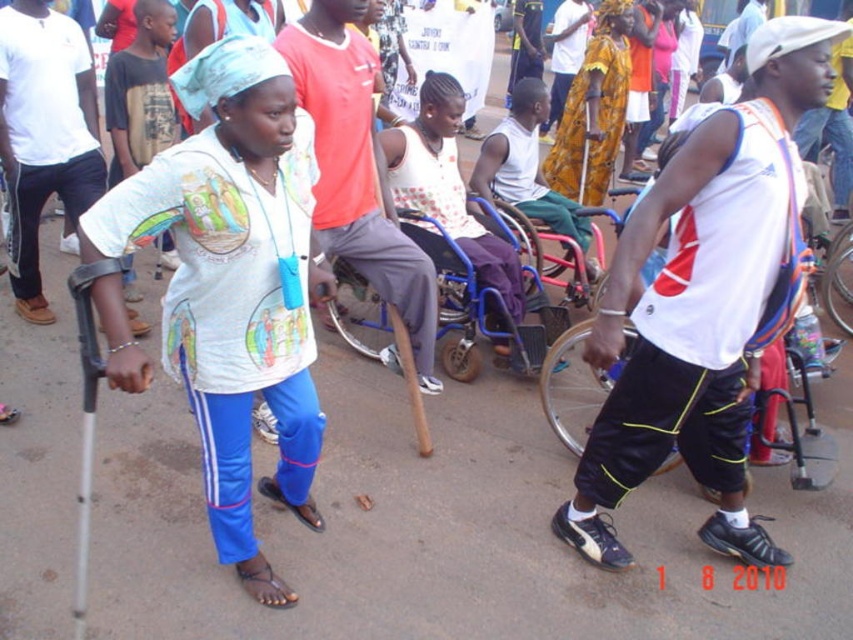
Does white matte shirt at left have a lesser width compared to blue plastic wheelchair at center?

Yes, white matte shirt at left is thinner than blue plastic wheelchair at center.

Is point (294, 124) positioned in front of point (440, 269)?

That is True.

What do you see at coordinates (234, 284) in the screenshot? This screenshot has width=853, height=640. I see `white matte shirt at left` at bounding box center [234, 284].

This screenshot has height=640, width=853. Find the location of `white matte shirt at left`. white matte shirt at left is located at coordinates (234, 284).

Does white matte shirt at left have a lesser width compared to wooden cane at center?

Correct, white matte shirt at left's width is less than wooden cane at center's.

Describe the element at coordinates (234, 284) in the screenshot. I see `white matte shirt at left` at that location.

Between point (196, 186) and point (317, 134), which one is positioned behind?

Point (317, 134)

This screenshot has height=640, width=853. I want to click on white matte shirt at left, so click(x=234, y=284).

Is wooden cane at center positioned at the back of silver metallic wheelchair at right?

Yes, it is behind silver metallic wheelchair at right.

Describe the element at coordinates (357, 170) in the screenshot. I see `wooden cane at center` at that location.

This screenshot has width=853, height=640. Find the location of `wooden cane at center`. wooden cane at center is located at coordinates (357, 170).